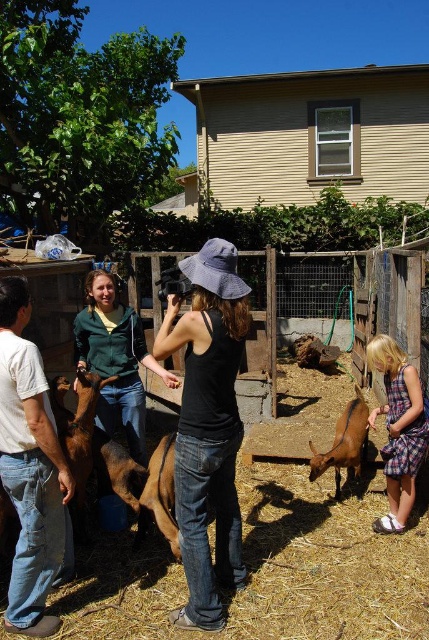
Consider the image. Does green fleece vest at center have a greater width compared to brown furry goat at lower center?

Yes, green fleece vest at center is wider than brown furry goat at lower center.

Between green fleece vest at center and brown furry goat at lower center, which one has less height?

brown furry goat at lower center

Who is more distant from viewer, (145, 355) or (335, 458)?

Point (335, 458)

Where is `green fleece vest at center`? The height and width of the screenshot is (640, 429). green fleece vest at center is located at coordinates (115, 358).

Is point (14, 406) closer to camera compared to point (90, 282)?

Yes.

Which is more to the right, white cotton shirt at left or green fleece vest at center?

Positioned to the right is green fleece vest at center.

Does point (21, 516) come behind point (96, 371)?

No, (21, 516) is in front of (96, 371).

This screenshot has width=429, height=640. In order to click on white cotton shirt at left in this screenshot , I will do `click(30, 470)`.

Is black cotton tank top at center above brown furry goat at lower center?

Yes, black cotton tank top at center is above brown furry goat at lower center.

Who is more forward, (223, 304) or (365, 429)?

Point (223, 304) is in front.

Identify the location of black cotton tank top at center. (208, 426).